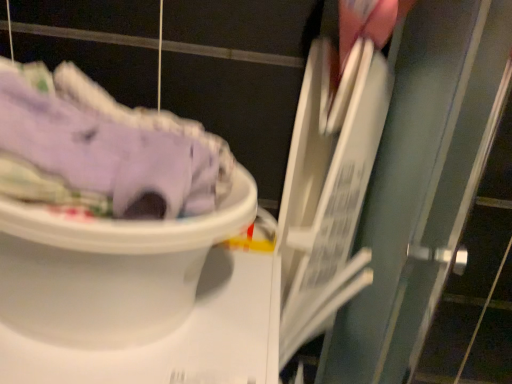
Question: In the image, is white plastic toilet at lower left positioned in front of or behind purple cotton pants at left?

Choices:
 (A) front
 (B) behind

Answer: (B)

Question: From their relative heights in the image, would you say white plastic toilet at lower left is taller or shorter than purple cotton pants at left?

Choices:
 (A) tall
 (B) short

Answer: (A)

Question: Is white plastic toilet at lower left bigger or smaller than purple cotton pants at left?

Choices:
 (A) big
 (B) small

Answer: (A)

Question: Is purple cotton pants at left inside the boundaries of white plastic toilet at lower left, or outside?

Choices:
 (A) inside
 (B) outside

Answer: (B)

Question: Is purple cotton pants at left bigger or smaller than white plastic toilet at lower left?

Choices:
 (A) big
 (B) small

Answer: (B)

Question: From the image's perspective, relative to white plastic toilet at lower left, is purple cotton pants at left above or below?

Choices:
 (A) above
 (B) below

Answer: (A)

Question: Considering their positions, is purple cotton pants at left located in front of or behind white plastic toilet at lower left?

Choices:
 (A) front
 (B) behind

Answer: (A)